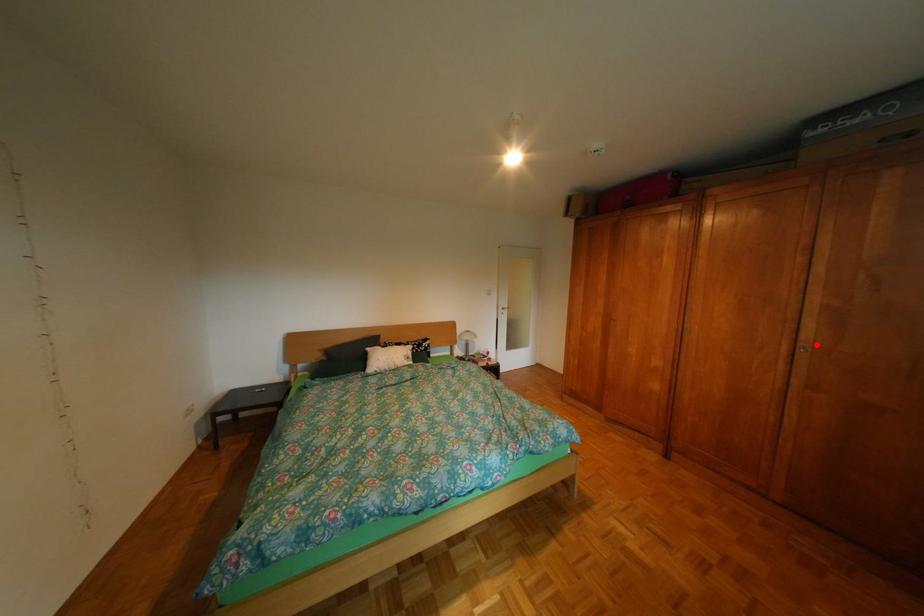
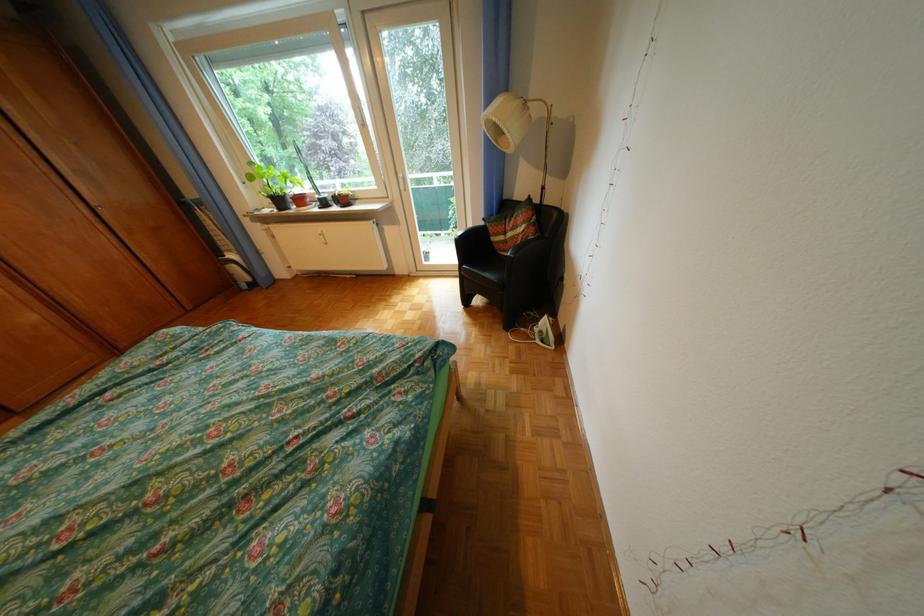
In the second image, find the point that corresponds to the highlighted location in the first image.

(110, 205)